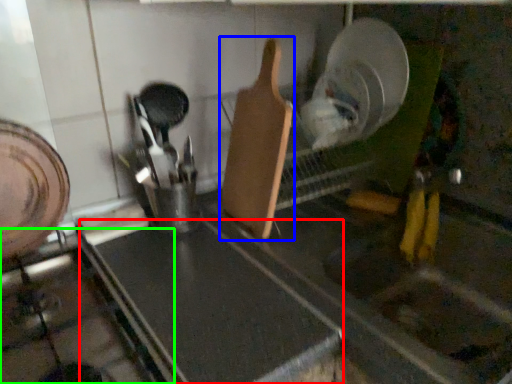
Question: Estimate the real-world distances between objects in this image. Which object is closer to counter top (highlighted by a red box), spatula (highlighted by a blue box) or gas stove (highlighted by a green box)?

Choices:
 (A) spatula
 (B) gas stove

Answer: (B)